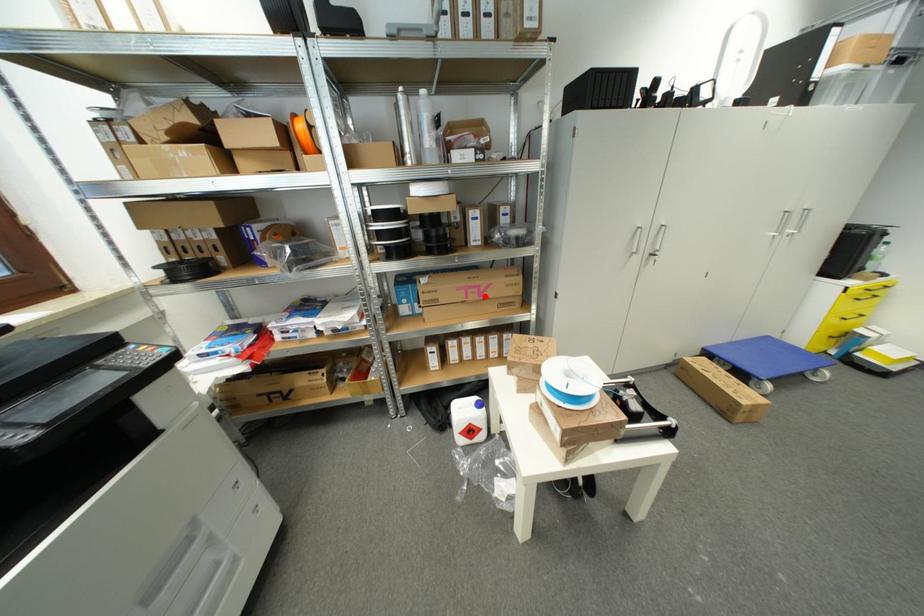
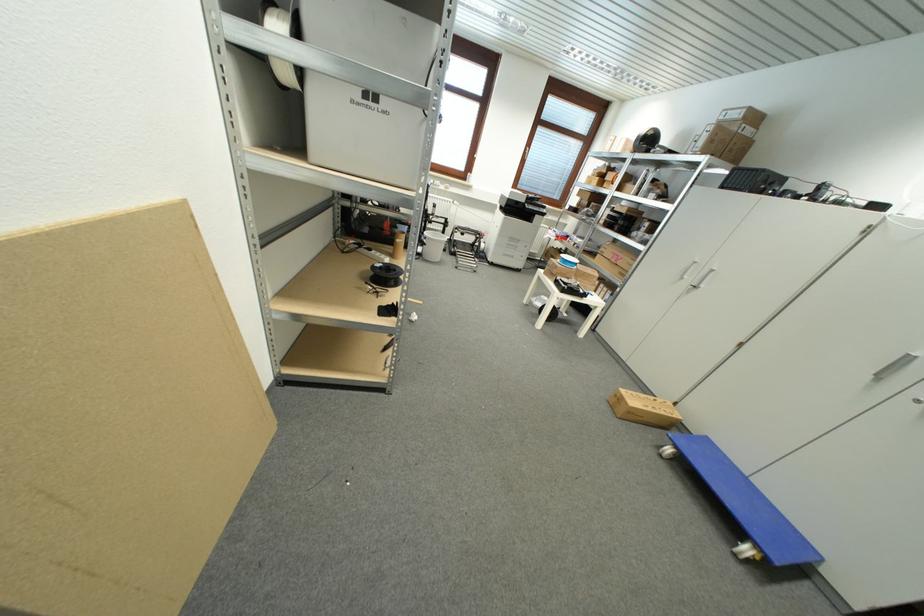
Question: I am providing you with two images of the same scene from different viewpoints. In image1, a red point is highlighted. Considering the same 3D point in image2, which of the following is correct?

Choices:
 (A) It is closer
 (B) It is farther

Answer: (A)